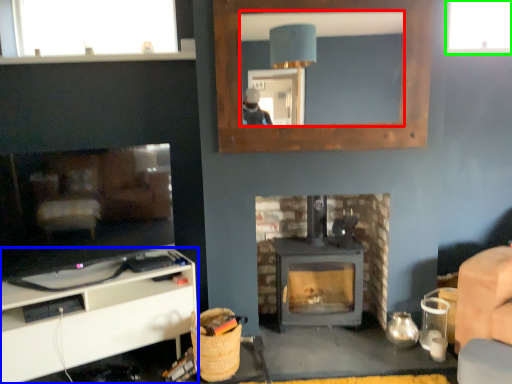
Question: Based on their relative distances, which object is nearer to mirror (highlighted by a red box)? Choose from cabinetry (highlighted by a blue box) and window (highlighted by a green box).

Choices:
 (A) cabinetry
 (B) window

Answer: (B)